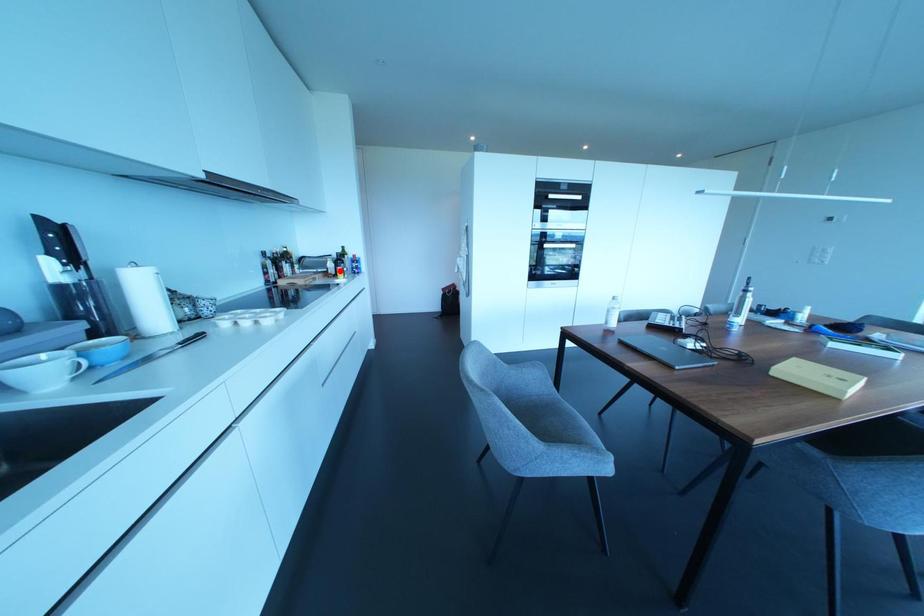
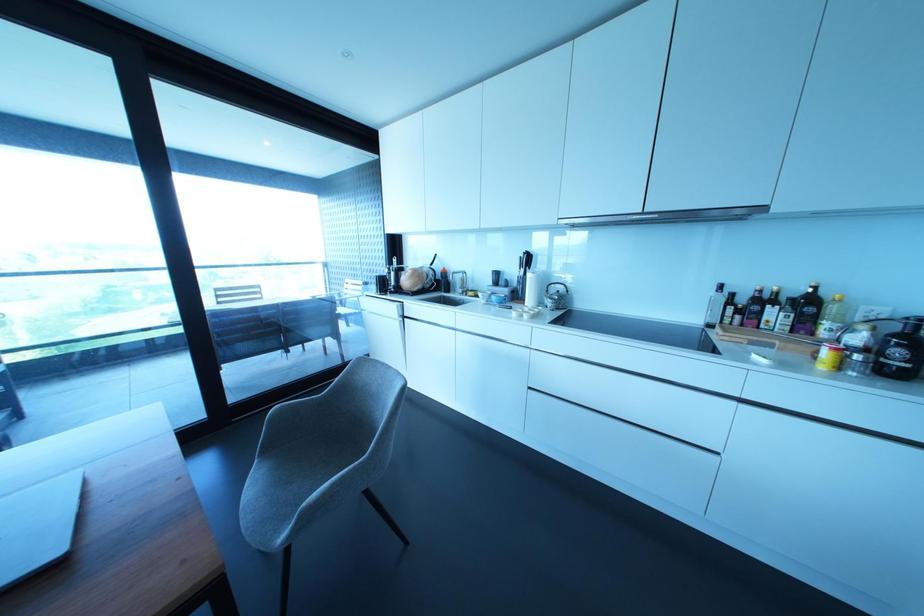
Question: I am providing you with two images of the same scene from different viewpoints. Image1 has a red point marked. In image2, the corresponding 3D location appears at what relative position? Reply with the corresponding letter.

Choices:
 (A) Closer
 (B) Farther

Answer: (B)